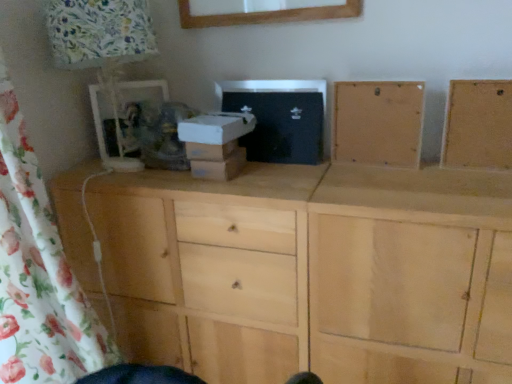
The height and width of the screenshot is (384, 512). What do you see at coordinates (478, 125) in the screenshot? I see `natural wood frame at upper right, which is the 1th cabinetry from right to left` at bounding box center [478, 125].

Identify the location of white cardboard box at center. This screenshot has height=384, width=512. (216, 144).

Locate an element on the screen. This screenshot has height=384, width=512. floral fabric lampshade at left is located at coordinates (102, 48).

Can you confirm if white cardboard box at center is shorter than floral fabric lampshade at left?

Correct, white cardboard box at center is not as tall as floral fabric lampshade at left.

Relative to floral fabric lampshade at left, is white cardboard box at center in front or behind?

In the image, white cardboard box at center appears behind floral fabric lampshade at left.

At what (x,y) coordinates should I click in order to perform the action: click on table lamp located above the white cardboard box at center (from a real-world perspective). Please return your answer as a coordinate pair (x, y). The height and width of the screenshot is (384, 512). Looking at the image, I should click on (102, 48).

Considering the sizes of objects white cardboard box at center and floral fabric lampshade at left in the image provided, who is thinner, white cardboard box at center or floral fabric lampshade at left?

Thinner between the two is white cardboard box at center.

How different are the orientations of floral fabric lampshade at left and white cardboard box at center in degrees?

2.09 degrees separate the facing orientations of floral fabric lampshade at left and white cardboard box at center.

Between floral fabric lampshade at left and white cardboard box at center, which one has smaller width?

With smaller width is white cardboard box at center.

Would you say floral fabric lampshade at left is inside or outside white cardboard box at center?

floral fabric lampshade at left cannot be found inside white cardboard box at center.

Is floral fabric lampshade at left taller or shorter than white cardboard box at center?

Clearly, floral fabric lampshade at left is taller compared to white cardboard box at center.

Considering the sizes of objects light wood cabinet at center, the first cabinetry positioned from the left, and floral fabric lampshade at left in the image provided, who is thinner, light wood cabinet at center, the first cabinetry positioned from the left, or floral fabric lampshade at left?

Thinner between the two is light wood cabinet at center, the first cabinetry positioned from the left.

Is light wood cabinet at center, the first cabinetry positioned from the left, not near floral fabric lampshade at left?

They are positioned close to each other.

Could you measure the distance between light wood cabinet at center, arranged as the 2th cabinetry when viewed from the right, and floral fabric lampshade at left?

light wood cabinet at center, arranged as the 2th cabinetry when viewed from the right, is 28.20 inches from floral fabric lampshade at left.

Is point (381, 105) less distant than point (100, 2)?

No, it is not.

In the scene shown: Is natural wood cabinet at center turned away from white cardboard box at center?

That's not correct — natural wood cabinet at center is not looking away from white cardboard box at center.

From the image's perspective, relative to white cardboard box at center, is natural wood cabinet at center above or below?

natural wood cabinet at center is situated lower than white cardboard box at center in the image.

Where is `box that appears above the natural wood cabinet at center (from the image's perspective)`? box that appears above the natural wood cabinet at center (from the image's perspective) is located at coordinates (216, 144).

From a real-world perspective, is natural wood cabinet at center under white cardboard box at center?

Yes, from a real-world perspective, natural wood cabinet at center is under white cardboard box at center.

How distant is natural wood cabinet at center from light wood cabinet at center, arranged as the 2th cabinetry when viewed from the right?

The distance of natural wood cabinet at center from light wood cabinet at center, arranged as the 2th cabinetry when viewed from the right, is 16.34 inches.

Considering the positions of objects natural wood cabinet at center and light wood cabinet at center, arranged as the 2th cabinetry when viewed from the right, in the image provided, who is behind, natural wood cabinet at center or light wood cabinet at center, arranged as the 2th cabinetry when viewed from the right,?

Positioned behind is light wood cabinet at center, arranged as the 2th cabinetry when viewed from the right.

From the image's perspective, is natural wood cabinet at center positioned above or below light wood cabinet at center, the first cabinetry positioned from the left?

From the image's perspective, natural wood cabinet at center appears below light wood cabinet at center, the first cabinetry positioned from the left.

Locate an element on the screen. chest of drawers in front of the light wood cabinet at center, arranged as the 2th cabinetry when viewed from the right is located at coordinates (314, 270).

Considering the relative sizes of light wood cabinet at center, the first cabinetry positioned from the left, and natural wood frame at upper right, which is the 1th cabinetry from right to left, in the image provided, is light wood cabinet at center, the first cabinetry positioned from the left, smaller than natural wood frame at upper right, which is the 1th cabinetry from right to left,?

Actually, light wood cabinet at center, the first cabinetry positioned from the left, might be larger than natural wood frame at upper right, which is the 1th cabinetry from right to left.

From a real-world perspective, relative to natural wood frame at upper right, positioned as the second cabinetry in left-to-right order, is light wood cabinet at center, the first cabinetry positioned from the left, vertically above or below?

In terms of real-world spatial position, light wood cabinet at center, the first cabinetry positioned from the left, is above natural wood frame at upper right, positioned as the second cabinetry in left-to-right order.

In the scene shown: Is light wood cabinet at center, arranged as the 2th cabinetry when viewed from the right, next to natural wood frame at upper right, which is the 1th cabinetry from right to left, and touching it?

No, light wood cabinet at center, arranged as the 2th cabinetry when viewed from the right, is not touching natural wood frame at upper right, which is the 1th cabinetry from right to left.

In the scene shown: From the image's perspective, is floral fabric lampshade at left on natural wood frame at upper right, positioned as the second cabinetry in left-to-right order?

Yes, from the image's perspective, floral fabric lampshade at left is above natural wood frame at upper right, positioned as the second cabinetry in left-to-right order.

Can you confirm if floral fabric lampshade at left is smaller than natural wood frame at upper right, which is the 1th cabinetry from right to left?

Incorrect, floral fabric lampshade at left is not smaller in size than natural wood frame at upper right, which is the 1th cabinetry from right to left.

Considering the sizes of objects floral fabric lampshade at left and natural wood frame at upper right, which is the 1th cabinetry from right to left, in the image provided, who is shorter, floral fabric lampshade at left or natural wood frame at upper right, which is the 1th cabinetry from right to left,?

natural wood frame at upper right, which is the 1th cabinetry from right to left, is shorter.

How much distance is there between floral fabric lampshade at left and natural wood frame at upper right, positioned as the second cabinetry in left-to-right order?

A distance of 39.09 inches exists between floral fabric lampshade at left and natural wood frame at upper right, positioned as the second cabinetry in left-to-right order.

The width and height of the screenshot is (512, 384). What are the coordinates of `box below the floral fabric lampshade at left (from a real-world perspective)` in the screenshot? It's located at (216, 144).

Where is `table lamp on the left of white cardboard box at center`? table lamp on the left of white cardboard box at center is located at coordinates (102, 48).

Based on their spatial positions, is light wood cabinet at center, arranged as the 2th cabinetry when viewed from the right, or natural wood cabinet at center closer to white cardboard box at center?

natural wood cabinet at center.

Which object lies further to the anchor point floral fabric lampshade at left, light wood cabinet at center, arranged as the 2th cabinetry when viewed from the right, or natural wood frame at upper right, positioned as the second cabinetry in left-to-right order?

The object further to floral fabric lampshade at left is natural wood frame at upper right, positioned as the second cabinetry in left-to-right order.

In the scene shown: Estimate the real-world distances between objects in this image. Which object is closer to natural wood frame at upper right, which is the 1th cabinetry from right to left, light wood cabinet at center, arranged as the 2th cabinetry when viewed from the right, or white cardboard box at center?

light wood cabinet at center, arranged as the 2th cabinetry when viewed from the right, lies closer to natural wood frame at upper right, which is the 1th cabinetry from right to left, than the other object.

In the scene shown: Looking at the image, which one is located further to natural wood frame at upper right, positioned as the second cabinetry in left-to-right order, natural wood cabinet at center or white cardboard box at center?

white cardboard box at center is further to natural wood frame at upper right, positioned as the second cabinetry in left-to-right order.

From the image, which object appears to be farther from light wood cabinet at center, the first cabinetry positioned from the left, floral fabric lampshade at left or natural wood cabinet at center?

The object further to light wood cabinet at center, the first cabinetry positioned from the left, is floral fabric lampshade at left.

Which object lies nearer to the anchor point light wood cabinet at center, the first cabinetry positioned from the left, natural wood frame at upper right, positioned as the second cabinetry in left-to-right order, or floral fabric lampshade at left?

natural wood frame at upper right, positioned as the second cabinetry in left-to-right order, lies closer to light wood cabinet at center, the first cabinetry positioned from the left, than the other object.

Looking at the image, which one is located further to light wood cabinet at center, the first cabinetry positioned from the left, natural wood cabinet at center or floral fabric lampshade at left?

floral fabric lampshade at left.

From the image, which object appears to be farther from light wood cabinet at center, the first cabinetry positioned from the left, white cardboard box at center or floral fabric lampshade at left?

floral fabric lampshade at left.

What are the coordinates of `chest of drawers between white cardboard box at center and natural wood frame at upper right, positioned as the second cabinetry in left-to-right order` in the screenshot? It's located at (314, 270).

Find the location of `box between floral fabric lampshade at left and natural wood cabinet at center in the up-down direction`. box between floral fabric lampshade at left and natural wood cabinet at center in the up-down direction is located at coordinates (216, 144).

Identify the location of cabinetry between light wood cabinet at center, the first cabinetry positioned from the left, and natural wood cabinet at center vertically. The width and height of the screenshot is (512, 384). (478, 125).

This screenshot has height=384, width=512. I want to click on box between floral fabric lampshade at left and natural wood frame at upper right, positioned as the second cabinetry in left-to-right order, in the horizontal direction, so click(x=216, y=144).